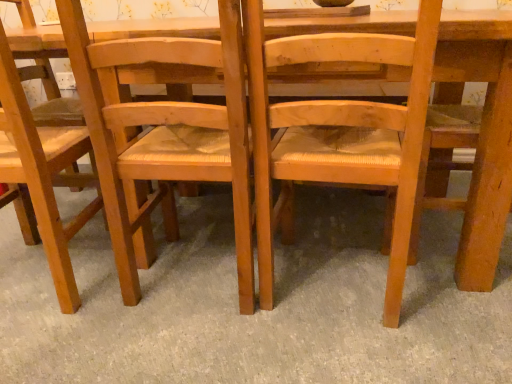
Question: Choose the correct answer: Is wooden woven seat at center, the 2th chair when ordered from right to left, inside light brown wood chair at left, arranged as the 3th chair when viewed from the right, or outside it?

Choices:
 (A) inside
 (B) outside

Answer: (B)

Question: Based on their sizes in the image, would you say wooden woven seat at center, the second chair in the left-to-right sequence, is bigger or smaller than light brown wood chair at left, which ranks as the 1th chair in left-to-right order?

Choices:
 (A) big
 (B) small

Answer: (B)

Question: Which object is positioned farthest from the natural wood chair at center, which ranks as the first chair in right-to-left order?

Choices:
 (A) wooden woven seat at center, the second chair in the left-to-right sequence
 (B) light brown wood chair at left, which ranks as the 1th chair in left-to-right order

Answer: (B)

Question: Which object is the farthest from the light brown wood chair at left, arranged as the 3th chair when viewed from the right?

Choices:
 (A) wooden woven seat at center, the second chair in the left-to-right sequence
 (B) natural wood chair at center, which ranks as the first chair in right-to-left order

Answer: (B)